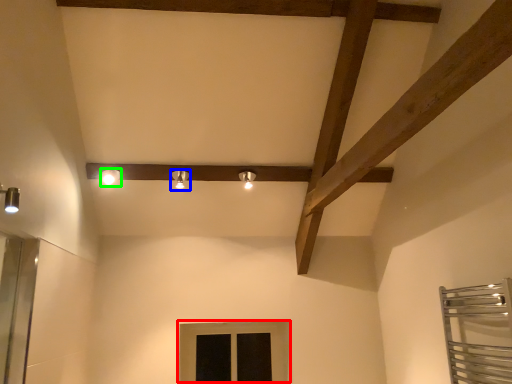
Question: Which object is positioned farthest from window (highlighted by a red box)? Select from light fixture (highlighted by a blue box) and light fixture (highlighted by a green box).

Choices:
 (A) light fixture
 (B) light fixture

Answer: (B)